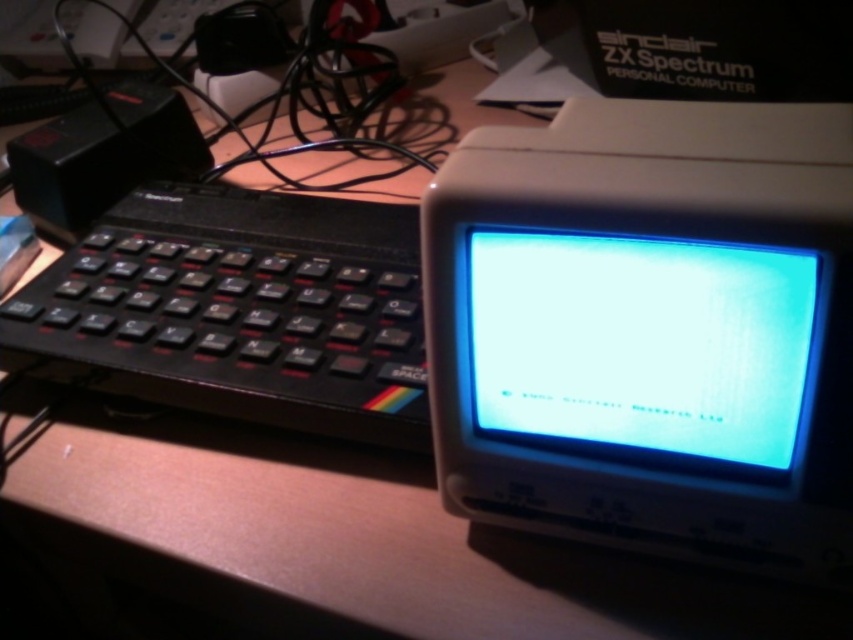
You are a technician who needs to connect a new cable to the white plastic monitor at center. The cable you have is 8 inches long. Will the cable be long enough to reach the monitor from your current position?

The white plastic monitor at center is 8.32 inches away from the viewer. The cable is only 8 inches long, which is shorter than the required distance. Therefore, the cable will not be long enough to reach the monitor.

You are setting up a desk for a retro computing exhibition. You have a white plastic monitor at center and a black plastic keyboard at left. Which object is taller?

The white plastic monitor at center is taller than the black plastic keyboard at left.

In the scene shown: You are holding a smartphone and want to take a photo of the black plastic keyboard at left. If your phone requires the subject to be at least 14 inches away from the lens to focus properly, will you need to move closer or farther away?

The black plastic keyboard at left is currently 12.87 inches away from the camera, which is closer than the required 14 inches. To focus properly, you need to move farther away until the distance reaches at least 14 inches.